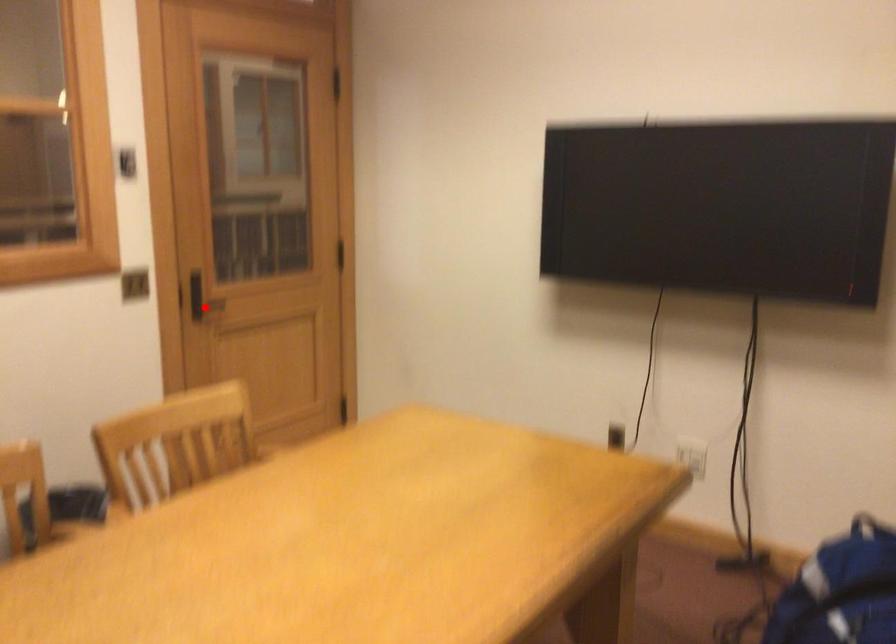
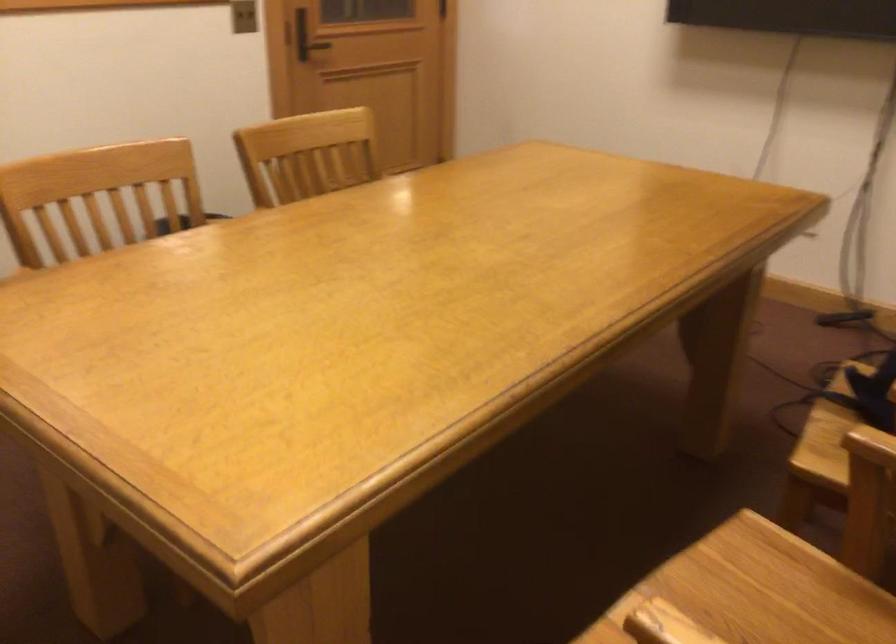
In the second image, find the point that corresponds to the highlighted location in the first image.

(308, 46)